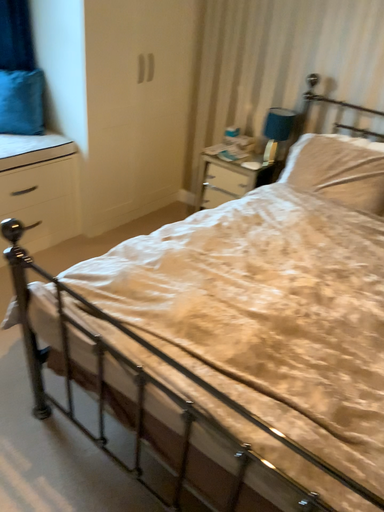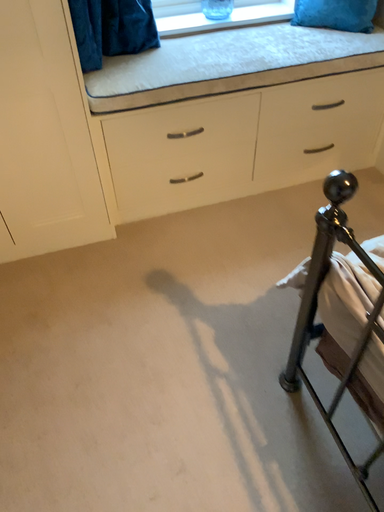
Question: How did the camera likely rotate when shooting the video?

Choices:
 (A) rotated upward
 (B) rotated downward

Answer: (B)